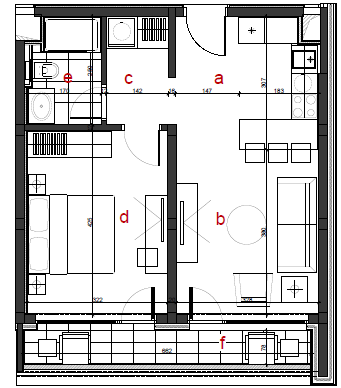
Locate an element on the screen. The width and height of the screenshot is (341, 388). door is located at coordinates (150, 298), (189, 294), (158, 144), (224, 25), (80, 116).